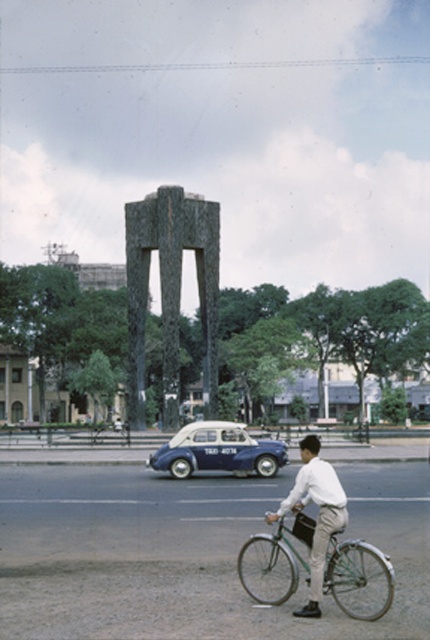
Who is lower down, white matte taxi at center or white matte shirt at center?

Positioned lower is white matte taxi at center.

Who is positioned more to the left, white matte taxi at center or white matte shirt at center?

white matte taxi at center is more to the left.

This screenshot has height=640, width=430. I want to click on white matte taxi at center, so click(218, 451).

Where is `white matte taxi at center`? white matte taxi at center is located at coordinates (218, 451).

Can you confirm if green matte bicycle at center is thinner than white matte taxi at center?

Yes, green matte bicycle at center is thinner than white matte taxi at center.

Can you confirm if green matte bicycle at center is positioned to the left of white matte taxi at center?

In fact, green matte bicycle at center is to the right of white matte taxi at center.

Measure the distance between green matte bicycle at center and camera.

They are 11.69 meters apart.

Identify the location of green matte bicycle at center. (355, 573).

Can you confirm if green matte bicycle at center is shorter than white matte shirt at center?

Correct, green matte bicycle at center is not as tall as white matte shirt at center.

Between point (335, 548) and point (301, 484), which one is positioned behind?

Point (301, 484)

Locate an element on the screen. This screenshot has width=430, height=640. green matte bicycle at center is located at coordinates (355, 573).